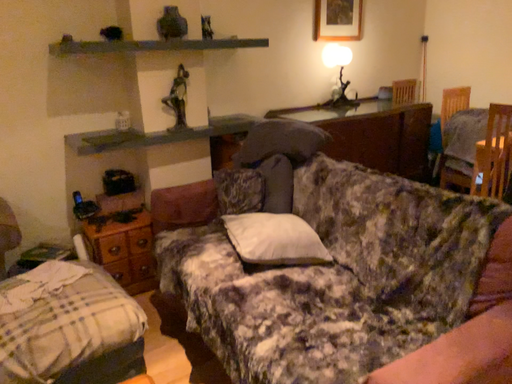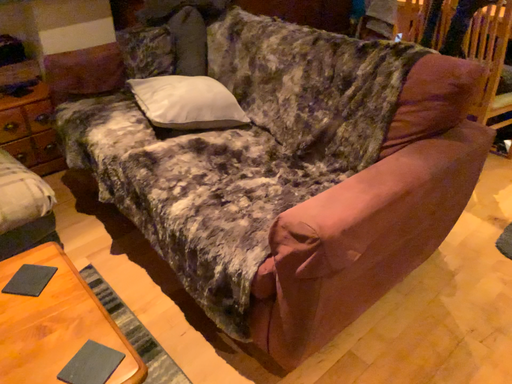
Question: How did the camera likely rotate when shooting the video?

Choices:
 (A) rotated downward
 (B) rotated upward

Answer: (A)